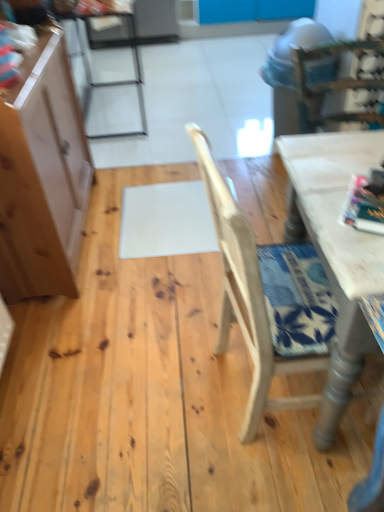
Question: From the image's perspective, would you say metallic silver chair at upper left, the 2th chair when ordered from front to back, is positioned over white painted wood table at right?

Choices:
 (A) yes
 (B) no

Answer: (A)

Question: From the image's perspective, is metallic silver chair at upper left, which is the second chair from bottom to top, beneath white painted wood table at right?

Choices:
 (A) no
 (B) yes

Answer: (A)

Question: From a real-world perspective, is metallic silver chair at upper left, which is the 1th chair from back to front, under white painted wood table at right?

Choices:
 (A) yes
 (B) no

Answer: (B)

Question: Can we say metallic silver chair at upper left, the 1th chair in the left-to-right sequence, lies outside white painted wood table at right?

Choices:
 (A) no
 (B) yes

Answer: (B)

Question: Is metallic silver chair at upper left, the 2th chair when ordered from front to back, not close to white painted wood table at right?

Choices:
 (A) no
 (B) yes

Answer: (B)

Question: Visually, is white matte table at upper right positioned to the left or to the right of light brown wood chair at center, which appears as the second chair when viewed from the left?

Choices:
 (A) left
 (B) right

Answer: (B)

Question: From their relative heights in the image, would you say white matte table at upper right is taller or shorter than light brown wood chair at center, placed as the 1th chair when sorted from front to back?

Choices:
 (A) tall
 (B) short

Answer: (B)

Question: In the image, is white matte table at upper right positioned in front of or behind light brown wood chair at center, which appears as the second chair when viewed from the left?

Choices:
 (A) front
 (B) behind

Answer: (B)

Question: Would you say white matte table at upper right is inside or outside light brown wood chair at center, the second chair positioned from the top?

Choices:
 (A) inside
 (B) outside

Answer: (B)

Question: In terms of height, does light brown wood cabinet at left look taller or shorter compared to light brown wood chair at center, acting as the second chair starting from the back?

Choices:
 (A) short
 (B) tall

Answer: (B)

Question: Is light brown wood cabinet at left in front of or behind light brown wood chair at center, the first chair viewed from the right, in the image?

Choices:
 (A) behind
 (B) front

Answer: (A)

Question: From a real-world perspective, is light brown wood cabinet at left physically located above or below light brown wood chair at center, which appears as the second chair when viewed from the left?

Choices:
 (A) below
 (B) above

Answer: (B)

Question: Looking at the image, does light brown wood cabinet at left seem bigger or smaller compared to light brown wood chair at center, the first chair viewed from the right?

Choices:
 (A) small
 (B) big

Answer: (B)

Question: Is point (350, 168) positioned closer to the camera than point (117, 15)?

Choices:
 (A) farther
 (B) closer

Answer: (B)

Question: From the image's perspective, is white painted wood table at right above or below metallic silver chair at upper left, which is the second chair from bottom to top?

Choices:
 (A) above
 (B) below

Answer: (B)